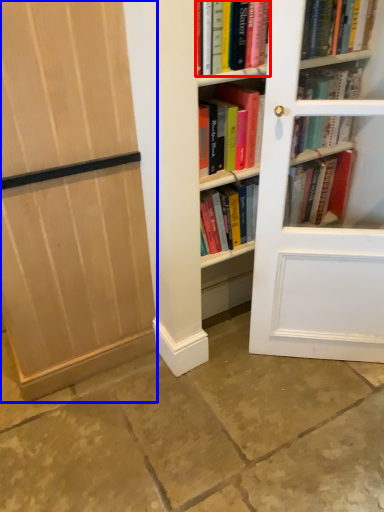
Question: Which point is further to the camera, book (highlighted by a red box) or door (highlighted by a blue box)?

Choices:
 (A) book
 (B) door

Answer: (A)